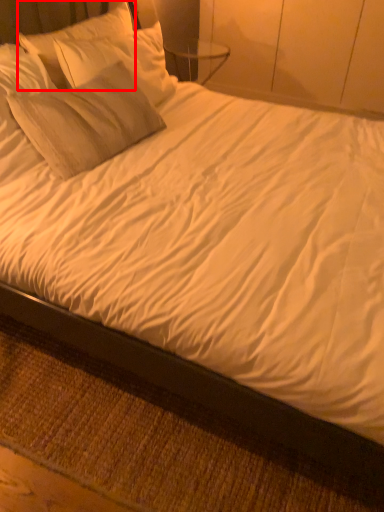
Question: From the image's perspective, considering the relative positions of pillow (annotated by the red box) and bed frame in the image provided, where is pillow (annotated by the red box) located with respect to the staircase?

Choices:
 (A) above
 (B) below

Answer: (A)